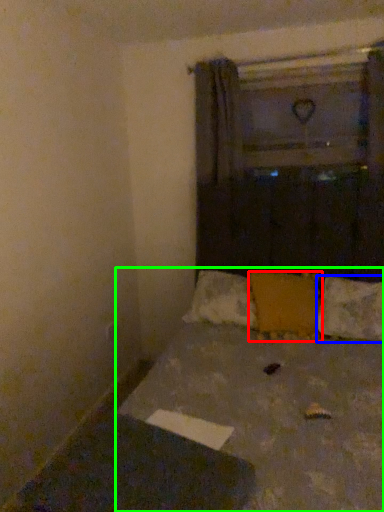
Question: Which is nearer to the pillow (highlighted by a red box)? pillow (highlighted by a blue box) or bed (highlighted by a green box).

Choices:
 (A) pillow
 (B) bed

Answer: (A)